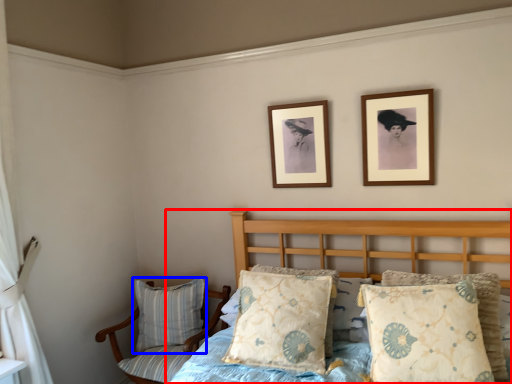
Question: Which point is closer to the camera, bed (highlighted by a red box) or pillow (highlighted by a blue box)?

Choices:
 (A) bed
 (B) pillow

Answer: (A)